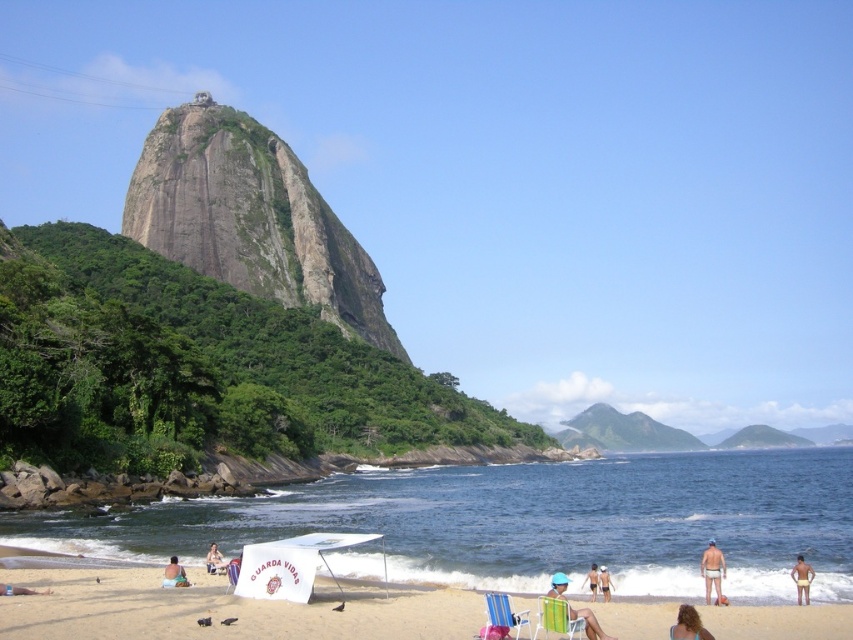
Can you confirm if blue striped beach chair at lower center is positioned to the left of tan skin person at center?

No, blue striped beach chair at lower center is not to the left of tan skin person at center.

Measure the distance between point (506, 600) and camera.

Point (506, 600) and camera are 32.57 meters apart.

Where is `blue striped beach chair at lower center`? Image resolution: width=853 pixels, height=640 pixels. blue striped beach chair at lower center is located at coordinates (503, 612).

What are the coordinates of `tan skin human at lower center` in the screenshot? It's located at (590, 580).

Who is shorter, tan skin human at lower center or white plastic beach chair at center?

tan skin human at lower center is shorter.

Between point (589, 584) and point (238, 557), which one is positioned in front?

Point (589, 584)

Find the location of a particular element. Image resolution: width=853 pixels, height=640 pixels. tan skin human at lower center is located at coordinates (590, 580).

Is blue water at beach lower positioned behind beige fabric towel at lower left?

Yes, blue water at beach lower is behind beige fabric towel at lower left.

Can you confirm if blue water at beach lower is positioned to the right of beige fabric towel at lower left?

Yes, blue water at beach lower is to the right of beige fabric towel at lower left.

Which is in front, point (764, 532) or point (165, 564)?

Point (165, 564) is more forward.

The height and width of the screenshot is (640, 853). Find the location of `blue water at beach lower`. blue water at beach lower is located at coordinates (527, 522).